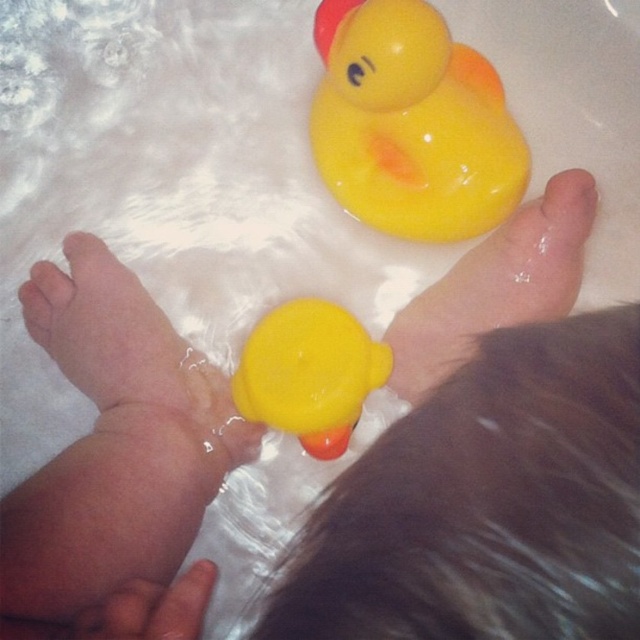
Which is more to the right, rubber duck at upper center or matte rubber foot at center?

Positioned to the right is matte rubber foot at center.

You are a GUI agent. You are given a task and a screenshot of the screen. Output one action in this format:
    pyautogui.click(x=<x>, y=<y>)
    Task: Click on the rubber duck at upper center
    The width and height of the screenshot is (640, 640).
    Given the screenshot: What is the action you would take?
    pyautogui.click(x=412, y=124)

Describe the element at coordinates (412, 124) in the screenshot. I see `rubber duck at upper center` at that location.

The height and width of the screenshot is (640, 640). Identify the location of rubber duck at upper center. (412, 124).

Who is positioned more to the left, matte rubber duck at upper center or matte rubber foot at center?

matte rubber duck at upper center

Is point (520, 588) behind point (470, 285)?

No, (520, 588) is closer to viewer.

Is point (192, 406) more distant than point (560, 289)?

No, it is in front of (560, 289).

At what (x,y) coordinates should I click in order to perform the action: click on matte rubber duck at upper center. Please return your answer as a coordinate pair (x, y). This screenshot has width=640, height=640. Looking at the image, I should click on (490, 460).

Measure the distance from rubber duck at upper center to matte yellow rubber duck at center.

rubber duck at upper center and matte yellow rubber duck at center are 6.83 inches apart.

Can you confirm if rubber duck at upper center is shorter than matte yellow rubber duck at center?

No, rubber duck at upper center is not shorter than matte yellow rubber duck at center.

Between point (483, 129) and point (339, 432), which one is positioned in front?

Positioned in front is point (339, 432).

Find the location of `rubber duck at upper center`. rubber duck at upper center is located at coordinates (412, 124).